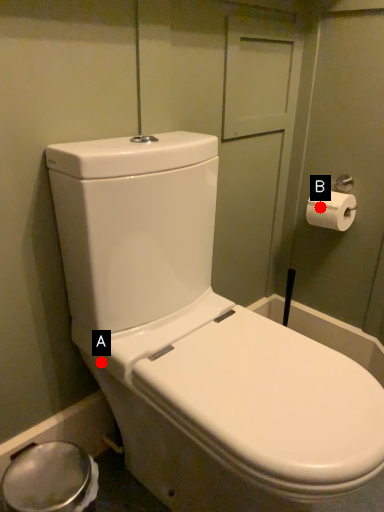
Question: Two points are circled on the image, labeled by A and B beside each circle. Which point is further to the camera?

Choices:
 (A) A is further
 (B) B is further

Answer: (B)